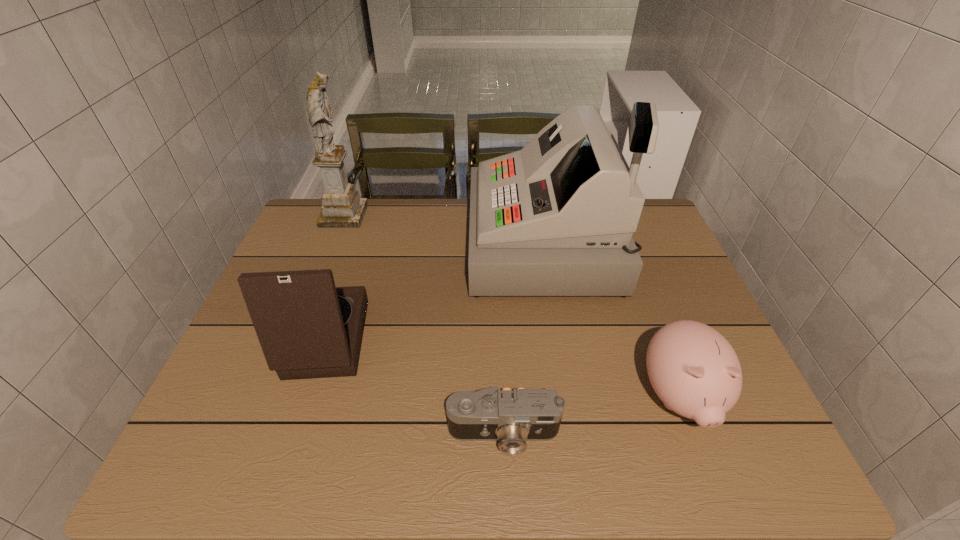
Locate an element on the screen. object that is at the near right corner is located at coordinates (693, 369).

Find the location of a particular element. vacant space at the far edge of the desktop is located at coordinates (408, 199).

In the image, there is a desktop. Where is `vacant space at the near edge`? vacant space at the near edge is located at coordinates pyautogui.click(x=528, y=462).

In the image, there is a desktop. Where is `vacant region at the left edge`? The image size is (960, 540). vacant region at the left edge is located at coordinates (252, 340).

Identify the location of free spot at the right edge of the desktop. This screenshot has width=960, height=540. 680,260.

Where is `vacant space at the far left corner of the desktop`? This screenshot has height=540, width=960. vacant space at the far left corner of the desktop is located at coordinates (348, 230).

Identify the location of vacant space that is in between the camera and the cash register. (524, 339).

At what (x,y) coordinates should I click in order to perform the action: click on free point between the cash register and the shortest object. Please return your answer as a coordinate pair (x, y). Looking at the image, I should click on (524, 339).

Where is `empty space between the phonograph record and the camera`? empty space between the phonograph record and the camera is located at coordinates (408, 387).

The width and height of the screenshot is (960, 540). What are the coordinates of `vacant region between the fourth tallest object and the third shortest object` in the screenshot? It's located at (496, 369).